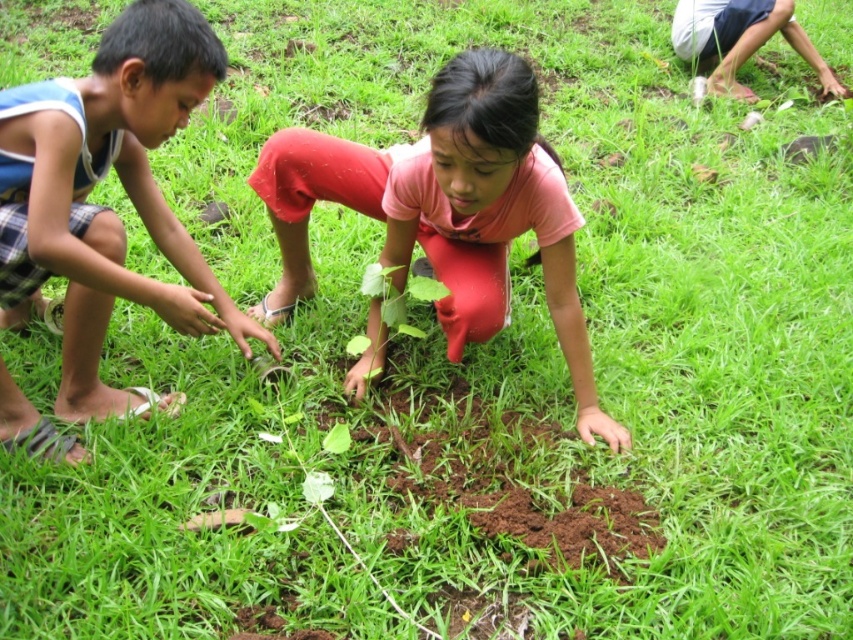
You are standing in the garden where the children are planting the sapling. You need to hand the blue plaid shorts at left a watering can that is 3 feet long. Can you reach them if you hold the watering can horizontally?

The blue plaid shorts at left is 6.51 feet away from the viewer. Since the watering can is only 3 feet long, you cannot reach them as the distance is greater than the watering can length.

You are standing in front of the scene where two children are planting a sapling. There are two points marked in the image. Which point, point (16,266) or point (561,308), is closer to you?

Point (16,266) is closer to the viewer than point (561,308).

You are a gardener who needs to place a 24 inch ruler between the blue plaid shorts at left and the pink matte shirt at center. Will the ruler fit entirely between them?

The distance between the blue plaid shorts at left and the pink matte shirt at center is 24.57 inches, so the 24 inch ruler will fit entirely between them since it is shorter than the distance between them.